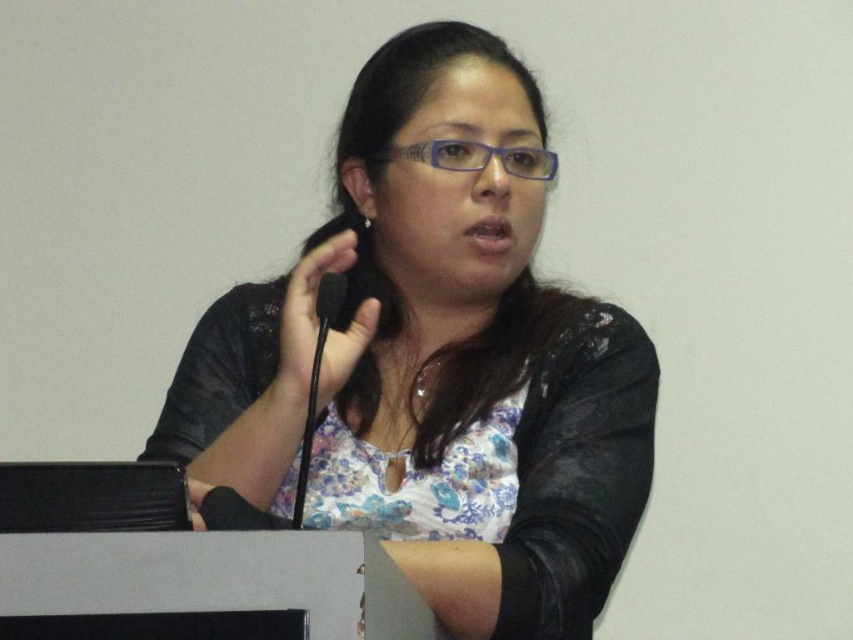
Question: Is blue plastic glasses at center closer to camera compared to black matte microphone at center?

Choices:
 (A) no
 (B) yes

Answer: (A)

Question: Estimate the real-world distances between objects in this image. Which object is closer to the blue plastic glasses at center?

Choices:
 (A) black foam microphone at center
 (B) black matte microphone at center

Answer: (A)

Question: Does blue plastic glasses at center appear under black matte microphone at center?

Choices:
 (A) yes
 (B) no

Answer: (B)

Question: Among these points, which one is nearest to the camera?

Choices:
 (A) click(x=318, y=307)
 (B) click(x=508, y=164)
 (C) click(x=328, y=288)
 (D) click(x=637, y=404)

Answer: (A)

Question: Which object is positioned farthest from the matte black jacket at center?

Choices:
 (A) blue plastic glasses at center
 (B) black foam microphone at center

Answer: (A)

Question: Does matte black jacket at center have a larger size compared to blue plastic glasses at center?

Choices:
 (A) yes
 (B) no

Answer: (A)